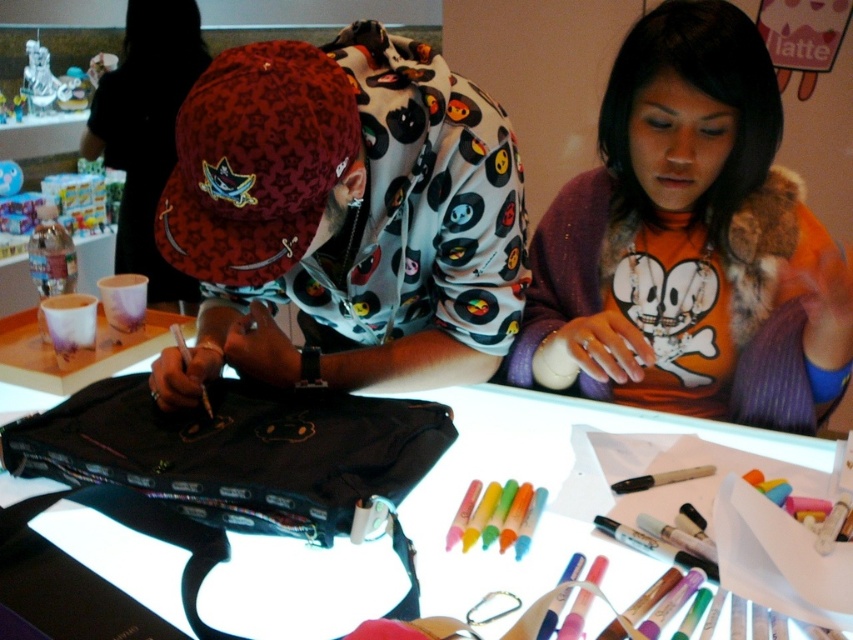
Between point (737, 445) and point (132, 252), which one is positioned in front?

Point (737, 445) is in front.

Who is taller, white paper at center or matte red cap at upper left?

matte red cap at upper left

Between point (547, 512) and point (134, 70), which one is positioned in front?

Point (547, 512)

Identify the location of white paper at center. The width and height of the screenshot is (853, 640). (546, 486).

Between orange fabric shirt at center and white paper at center, which one is positioned lower?

white paper at center

Is point (845, 340) less distant than point (463, 413)?

Yes, it is.

Where is `orange fabric shirt at center`? The width and height of the screenshot is (853, 640). orange fabric shirt at center is located at coordinates (689, 243).

Does orange fabric shirt at center have a smaller size compared to matte red cap at upper left?

Yes, orange fabric shirt at center is smaller than matte red cap at upper left.

Can you confirm if orange fabric shirt at center is thinner than matte red cap at upper left?

No, orange fabric shirt at center is not thinner than matte red cap at upper left.

Is point (724, 353) farther from viewer compared to point (119, 216)?

No, it is in front of (119, 216).

Identify the location of orange fabric shirt at center. The height and width of the screenshot is (640, 853). (689, 243).